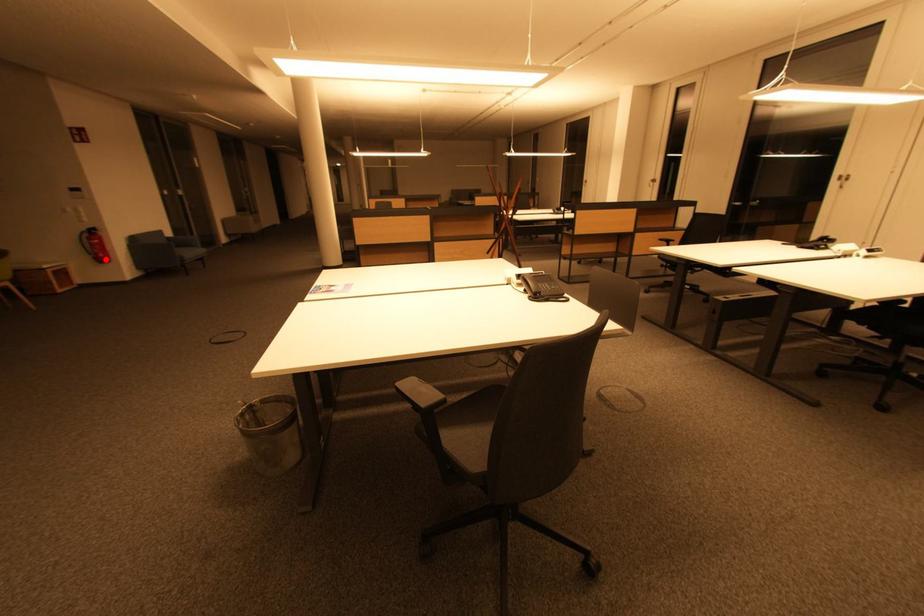
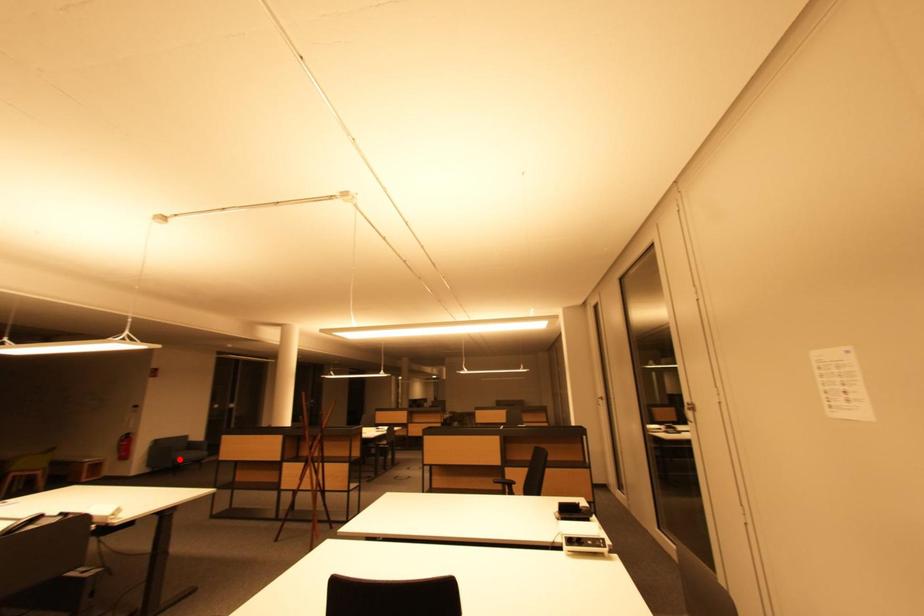
I am providing you with two images of the same scene from different viewpoints. A red point is marked on the first image and another point is marked on the second image. Is the red point in image1 aligned with the point shown in image2?

No